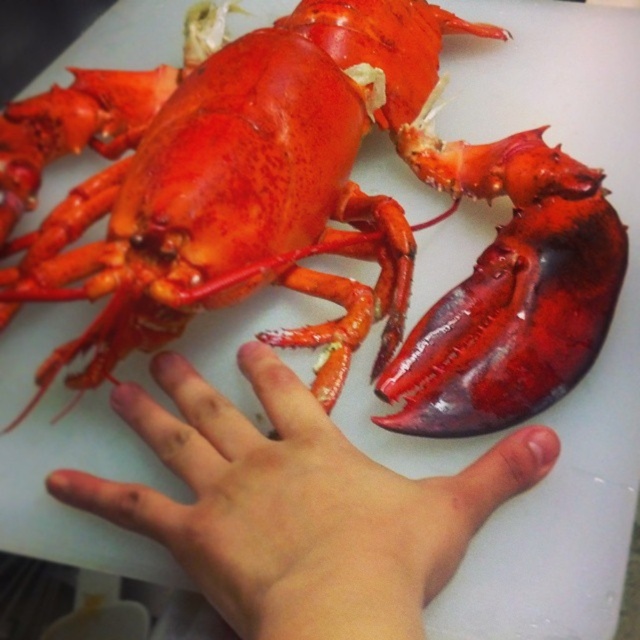
Question: Which point is closer to the camera?

Choices:
 (A) (451, 300)
 (B) (77, 490)

Answer: (B)

Question: Does shiny red lobster at center have a smaller size compared to pale skin palm at center?

Choices:
 (A) yes
 (B) no

Answer: (B)

Question: Which object appears closest to the camera in this image?

Choices:
 (A) pale skin palm at center
 (B) shiny red lobster at center

Answer: (A)

Question: In this image, where is shiny red lobster at center located relative to pale skin palm at center?

Choices:
 (A) left
 (B) right

Answer: (B)

Question: Is shiny red lobster at center bigger than pale skin palm at center?

Choices:
 (A) no
 (B) yes

Answer: (B)